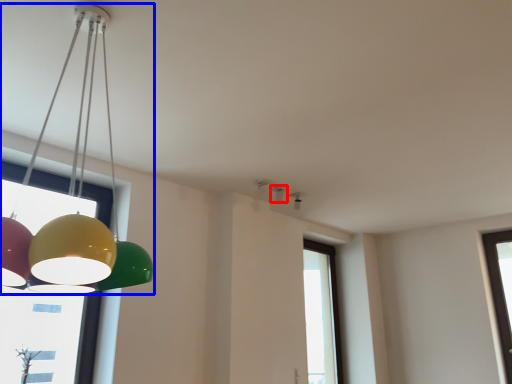
Question: Which object is closer to the camera taking this photo, lamp (highlighted by a red box) or lamp (highlighted by a blue box)?

Choices:
 (A) lamp
 (B) lamp

Answer: (B)